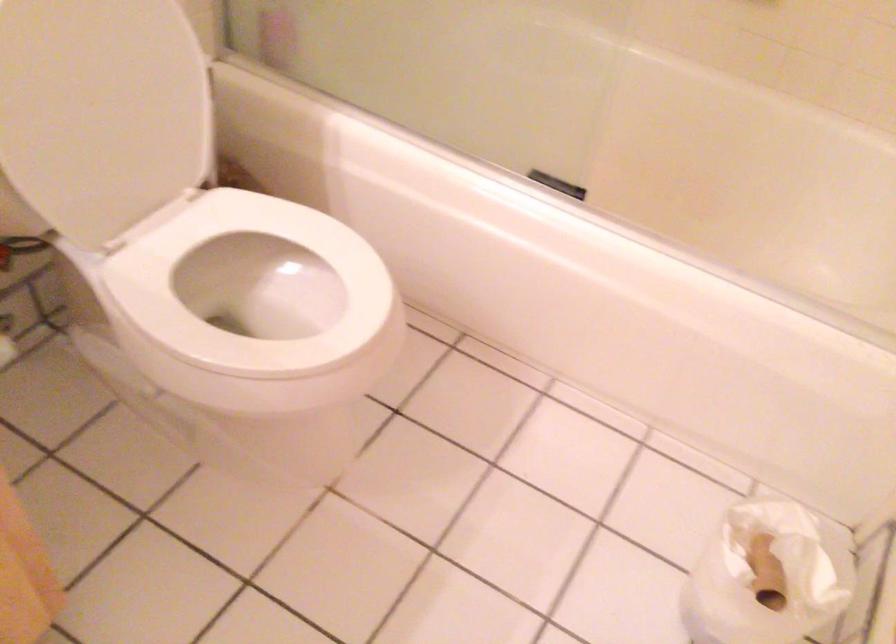
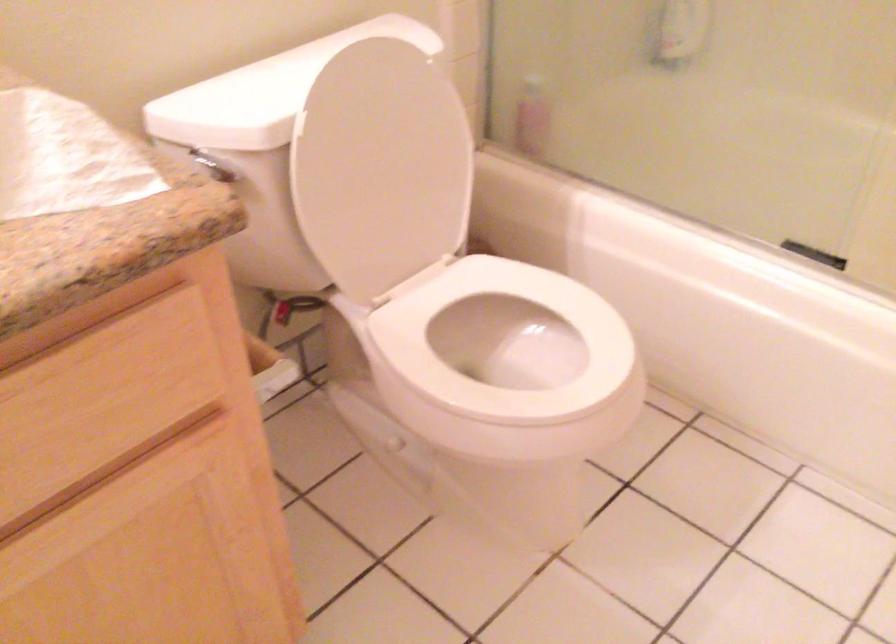
Question: The first image is from the beginning of the video and the second image is from the end. How did the camera likely rotate when shooting the video?

Choices:
 (A) Left
 (B) Right
 (C) Up
 (D) Down

Answer: (A)